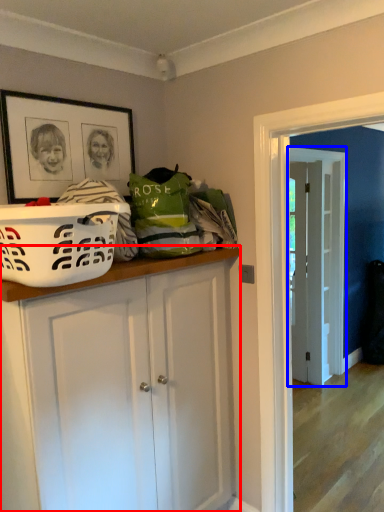
Question: Which object is closer to the camera taking this photo, cabinetry (highlighted by a red box) or door (highlighted by a blue box)?

Choices:
 (A) cabinetry
 (B) door

Answer: (A)